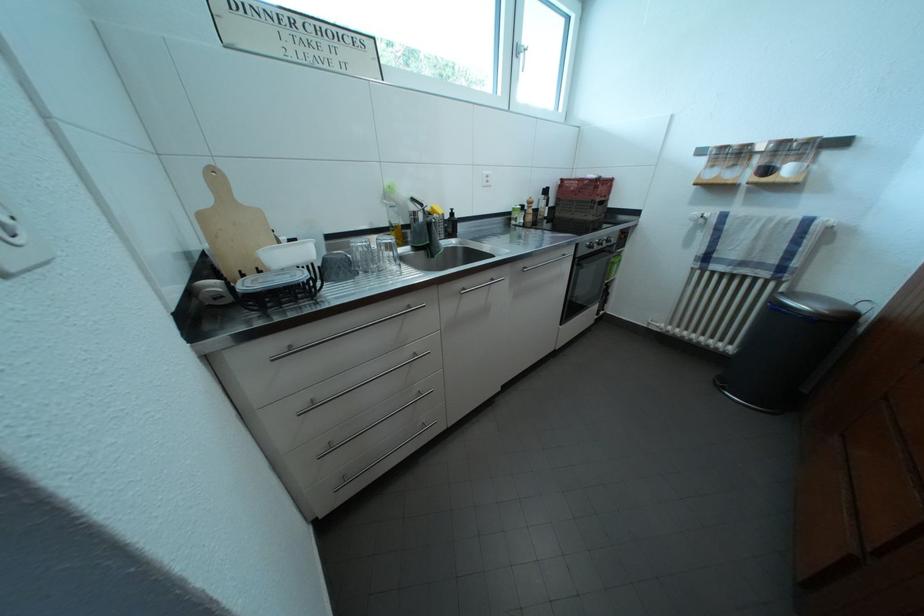
The image size is (924, 616). What do you see at coordinates (520, 55) in the screenshot? I see `the white window handle` at bounding box center [520, 55].